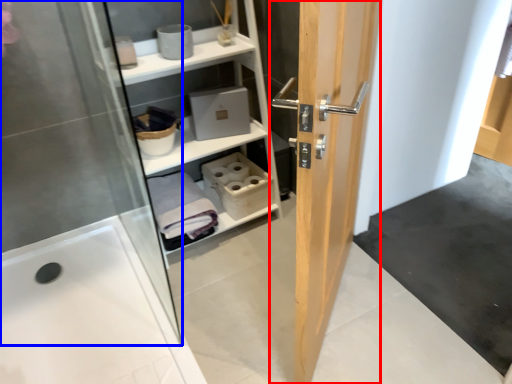
Question: Which point is further to the camera, door (highlighted by a red box) or screen door (highlighted by a blue box)?

Choices:
 (A) door
 (B) screen door

Answer: (B)